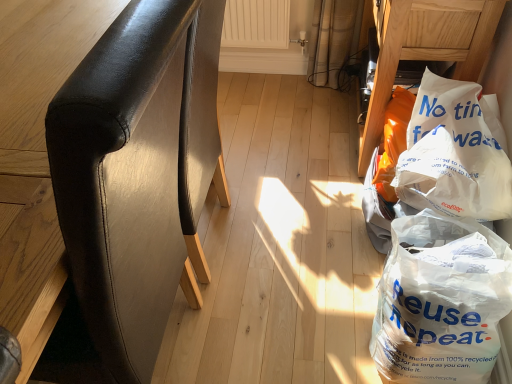
Question: Relative to black leather chair at left, which ranks as the second furniture in right-to-left order, is white plastic bag at lower right, which is the second plastic bag from top to bottom, in front or behind?

Choices:
 (A) front
 (B) behind

Answer: (B)

Question: Is white plastic bag at lower right, which is the second plastic bag from top to bottom, spatially inside black leather chair at left, which ranks as the second furniture in right-to-left order, or outside of it?

Choices:
 (A) outside
 (B) inside

Answer: (A)

Question: Which object is positioned farthest from the white plastic bag at lower right, the second furniture when ordered from left to right?

Choices:
 (A) white plastic bag at lower right, positioned as the 1th plastic bag in bottom-to-top order
 (B) black leather chair at left, the first furniture from the left
 (C) white paper bag at lower right, the second plastic bag when ordered from bottom to top

Answer: (B)

Question: Which of these objects is positioned farthest from the white paper bag at lower right, the second plastic bag when ordered from bottom to top?

Choices:
 (A) black leather chair at left, the first furniture from the left
 (B) white plastic bag at lower right, positioned as the 1th plastic bag in bottom-to-top order
 (C) white plastic bag at lower right, which is the 1th furniture in right-to-left order

Answer: (A)